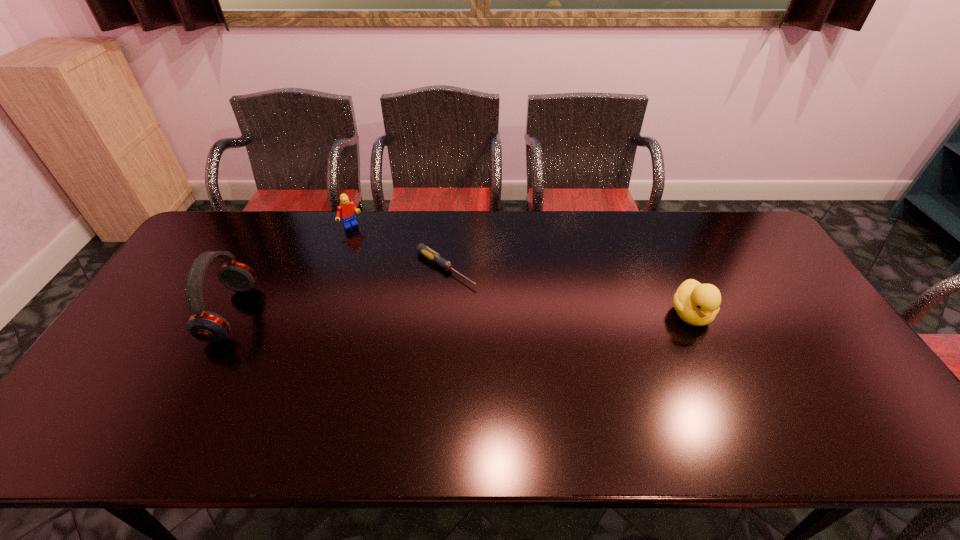
In order to click on free spot at the far right corner of the desktop in this screenshot , I will do `click(750, 245)`.

Find the location of a particular element. This screenshot has width=960, height=540. empty space between the rightmost object and the earphone is located at coordinates (461, 314).

Identify the location of free space between the rightmost object and the tallest object. The image size is (960, 540). (461, 314).

Locate an element on the screen. This screenshot has width=960, height=540. vacant region between the rightmost object and the earphone is located at coordinates (461, 314).

Locate an element on the screen. free point between the farthest object and the third object from left to right is located at coordinates (398, 247).

Where is `vacant point located between the second object from left to right and the shortest object`? vacant point located between the second object from left to right and the shortest object is located at coordinates (398, 247).

You are a GUI agent. You are given a task and a screenshot of the screen. Output one action in this format:
    pyautogui.click(x=<x>, y=<y>)
    Task: Click on the vacant area that lies between the rightmost object and the earphone
    The width and height of the screenshot is (960, 540).
    Given the screenshot: What is the action you would take?
    pyautogui.click(x=461, y=314)

Locate an element on the screen. The image size is (960, 540). vacant point located between the third object from left to right and the duck is located at coordinates (568, 291).

Where is `free point between the duck and the earphone`? The height and width of the screenshot is (540, 960). free point between the duck and the earphone is located at coordinates [461, 314].

Where is `free spot between the Lego and the second object from right to left`? The image size is (960, 540). free spot between the Lego and the second object from right to left is located at coordinates (398, 247).